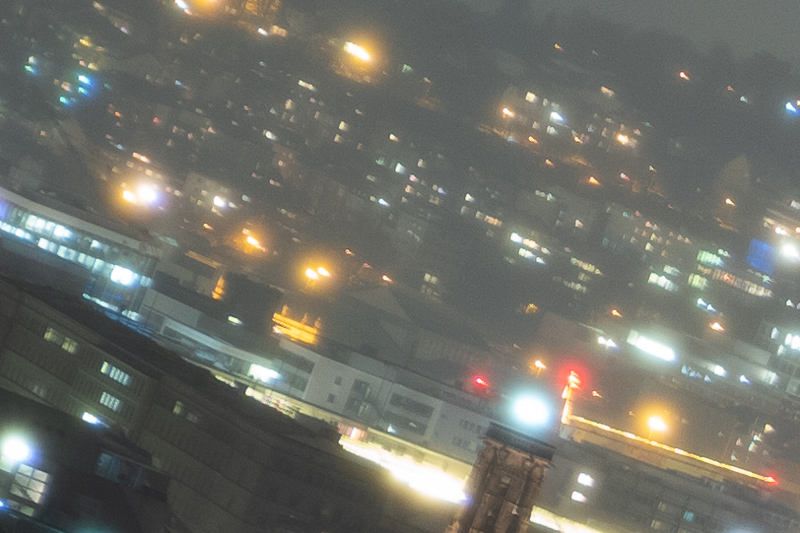
Find the location of a particular element. corner is located at coordinates (762, 516), (12, 516), (21, 19), (777, 15).